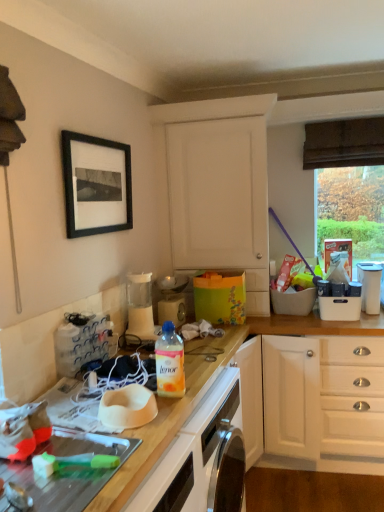
Question: In the image, is translucent plastic bottle at center positioned in front of or behind white plastic container at upper right, acting as the second appliance starting from the left?

Choices:
 (A) behind
 (B) front

Answer: (B)

Question: Choose the correct answer: Is translucent plastic bottle at center inside white plastic container at upper right, the 1th appliance when ordered from right to left, or outside it?

Choices:
 (A) outside
 (B) inside

Answer: (A)

Question: Based on their relative distances, which object is farther from the white plastic container at upper right, the 1th appliance when ordered from right to left?

Choices:
 (A) white matte cabinet at upper center
 (B) black matte picture frame at upper left
 (C) matte plastic blender at center, the 1th appliance positioned from the left
 (D) white glossy oven at lower center
 (E) translucent plastic bottle at center

Answer: (B)

Question: Which object is the closest to the white plastic container at upper right, acting as the second appliance starting from the left?

Choices:
 (A) white glossy oven at lower center
 (B) white matte cabinet at upper center
 (C) matte plastic blender at center, the 1th appliance positioned from the left
 (D) translucent plastic bottle at center
 (E) black matte picture frame at upper left

Answer: (B)